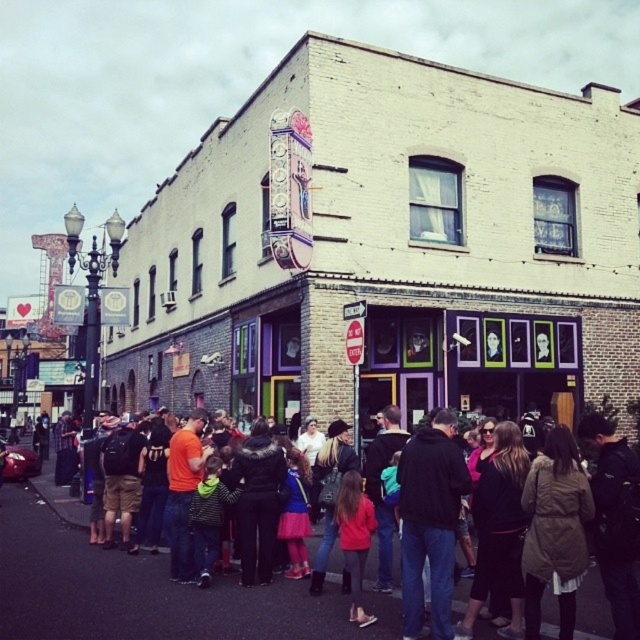
Who is positioned more to the left, dark brown leather jacket at center or dark blue jeans at center?

dark brown leather jacket at center is more to the left.

Which of these two, dark brown leather jacket at center or dark blue jeans at center, stands shorter?

Standing shorter between the two is dark brown leather jacket at center.

What do you see at coordinates (182, 602) in the screenshot?
I see `dark brown leather jacket at center` at bounding box center [182, 602].

In order to click on dark brown leather jacket at center in this screenshot , I will do `click(182, 602)`.